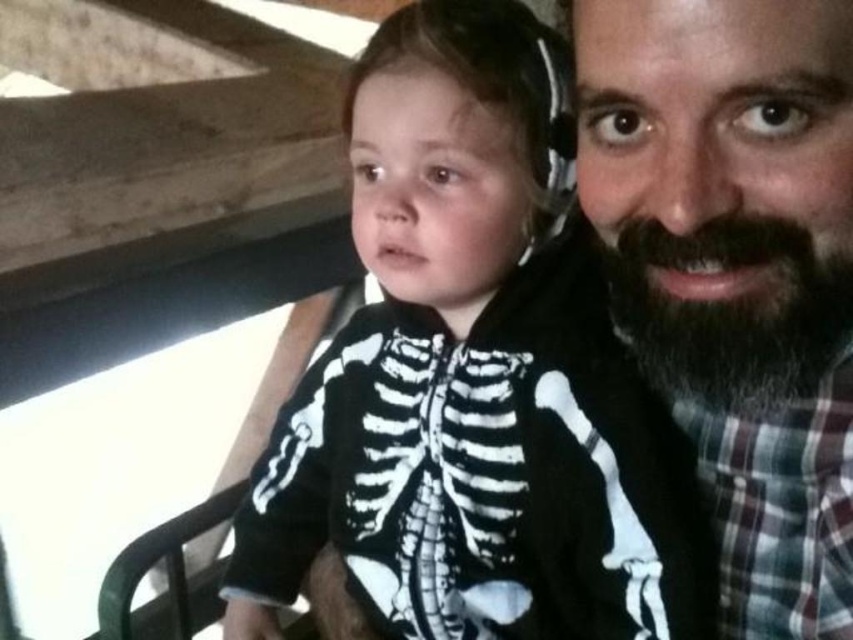
Between bearded man at right and dark brown fuzzy beard at upper right, which one is positioned lower?

dark brown fuzzy beard at upper right is below.

The height and width of the screenshot is (640, 853). In order to click on bearded man at right in this screenshot , I will do `click(735, 272)`.

This screenshot has width=853, height=640. What are the coordinates of `bearded man at right` in the screenshot? It's located at (735, 272).

Describe the element at coordinates (473, 381) in the screenshot. This screenshot has height=640, width=853. I see `black matte skeleton onesie at center` at that location.

Is black matte skeleton onesie at center wider than dark brown fuzzy beard at upper right?

Indeed, black matte skeleton onesie at center has a greater width compared to dark brown fuzzy beard at upper right.

Is point (579, 404) positioned after point (706, 380)?

That is True.

You are a GUI agent. You are given a task and a screenshot of the screen. Output one action in this format:
    pyautogui.click(x=<x>, y=<y>)
    Task: Click on the black matte skeleton onesie at center
    Image resolution: width=853 pixels, height=640 pixels.
    Given the screenshot: What is the action you would take?
    pyautogui.click(x=473, y=381)

Can you confirm if black matte skeleton onesie at center is positioned to the right of bearded man at right?

Incorrect, black matte skeleton onesie at center is not on the right side of bearded man at right.

Which is more to the right, black matte skeleton onesie at center or bearded man at right?

bearded man at right

Who is more forward, (520,400) or (795,513)?

Positioned in front is point (795,513).

Identify the location of black matte skeleton onesie at center. The width and height of the screenshot is (853, 640). point(473,381).